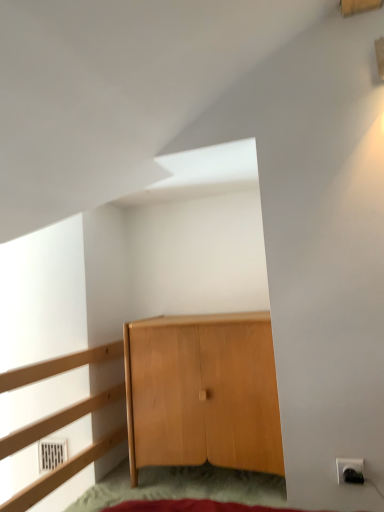
What do you see at coordinates (203, 393) in the screenshot? Image resolution: width=384 pixels, height=512 pixels. I see `light brown wood cabinet at center` at bounding box center [203, 393].

Locate an element on the screen. The width and height of the screenshot is (384, 512). light brown wood cabinet at center is located at coordinates (203, 393).

Measure the distance from light brown wood cabinet at center to white plastic electric outlet at lower right.

light brown wood cabinet at center is 67.56 centimeters from white plastic electric outlet at lower right.

Is light brown wood cabinet at center situated inside white plastic electric outlet at lower right or outside?

light brown wood cabinet at center is located beyond the bounds of white plastic electric outlet at lower right.

Considering the positions of points (278, 468) and (338, 465), is point (278, 468) farther from camera compared to point (338, 465)?

Yes, it is.

What's the angular difference between light brown wood cabinet at center and white plastic electric outlet at lower right's facing directions?

light brown wood cabinet at center and white plastic electric outlet at lower right are facing 0.00761 degrees away from each other.

Is light wood dresser at left positioned far away from light brown wood cabinet at center?

No, light wood dresser at left is not far from light brown wood cabinet at center.

Is light wood dresser at left positioned in front of light brown wood cabinet at center?

Yes, the depth of light wood dresser at left is less than that of light brown wood cabinet at center.

Based on the photo, can we say light wood dresser at left lies outside light brown wood cabinet at center?

That's correct, light wood dresser at left is outside of light brown wood cabinet at center.

How many degrees apart are the facing directions of light wood dresser at left and light brown wood cabinet at center?

0.381 degrees separate the facing orientations of light wood dresser at left and light brown wood cabinet at center.

This screenshot has width=384, height=512. Identify the location of dresser above the light brown wood cabinet at center (from a real-world perspective). (63, 472).

Is light brown wood cabinet at center located outside light wood dresser at left?

Absolutely, light brown wood cabinet at center is external to light wood dresser at left.

From the image's perspective, which is above, light brown wood cabinet at center or light wood dresser at left?

light wood dresser at left appears higher in the image.

Is light brown wood cabinet at center taller than light wood dresser at left?

No, light brown wood cabinet at center is not taller than light wood dresser at left.

What are the coordinates of `electric outlet below the light wood dresser at left (from the image's perspective)` in the screenshot? It's located at (350, 470).

Considering the sizes of white plastic electric outlet at lower right and light wood dresser at left in the image, is white plastic electric outlet at lower right bigger or smaller than light wood dresser at left?

Considering their sizes, white plastic electric outlet at lower right takes up less space than light wood dresser at left.

What's the angular difference between white plastic electric outlet at lower right and light wood dresser at left's facing directions?

0.375 degrees separate the facing orientations of white plastic electric outlet at lower right and light wood dresser at left.

Is white plastic electric outlet at lower right aimed at light wood dresser at left?

No, white plastic electric outlet at lower right is not turned towards light wood dresser at left.

From the image's perspective, relative to light brown wood cabinet at center, is white plastic electric outlet at lower right above or below?

white plastic electric outlet at lower right is situated lower than light brown wood cabinet at center in the image.

Does white plastic electric outlet at lower right lie in front of light brown wood cabinet at center?

Yes, white plastic electric outlet at lower right is in front of light brown wood cabinet at center.

How far apart are white plastic electric outlet at lower right and light brown wood cabinet at center?

26.60 inches.

Considering the relative sizes of white plastic electric outlet at lower right and light brown wood cabinet at center in the image provided, is white plastic electric outlet at lower right taller than light brown wood cabinet at center?

Incorrect, the height of white plastic electric outlet at lower right is not larger of that of light brown wood cabinet at center.

From their relative heights in the image, would you say light wood dresser at left is taller or shorter than white plastic electric outlet at lower right?

Considering their sizes, light wood dresser at left has more height than white plastic electric outlet at lower right.

Is light wood dresser at left wider than white plastic electric outlet at lower right?

Correct, the width of light wood dresser at left exceeds that of white plastic electric outlet at lower right.

Could you tell me if light wood dresser at left is turned towards white plastic electric outlet at lower right?

No, light wood dresser at left is not facing towards white plastic electric outlet at lower right.

The image size is (384, 512). I want to click on dresser in front of the white plastic electric outlet at lower right, so click(63, 472).

Where is `cupboard on the left of white plastic electric outlet at lower right`? cupboard on the left of white plastic electric outlet at lower right is located at coordinates (203, 393).

I want to click on cupboard located below the light wood dresser at left (from the image's perspective), so click(203, 393).

Considering their positions, is light brown wood cabinet at center positioned closer to white plastic electric outlet at lower right than light wood dresser at left?

Based on the image, light brown wood cabinet at center appears to be nearer to white plastic electric outlet at lower right.

When comparing their distances from white plastic electric outlet at lower right, does light wood dresser at left or light brown wood cabinet at center seem closer?

light brown wood cabinet at center lies closer to white plastic electric outlet at lower right than the other object.

Looking at this image, looking at the image, which one is located further to light brown wood cabinet at center, white plastic electric outlet at lower right or light wood dresser at left?

white plastic electric outlet at lower right lies further to light brown wood cabinet at center than the other object.

Based on their spatial positions, is white plastic electric outlet at lower right or light brown wood cabinet at center further from light wood dresser at left?

The object further to light wood dresser at left is white plastic electric outlet at lower right.

Which object lies nearer to the anchor point light wood dresser at left, light brown wood cabinet at center or white plastic electric outlet at lower right?

light brown wood cabinet at center is positioned closer to the anchor light wood dresser at left.

Based on their spatial positions, is light wood dresser at left or white plastic electric outlet at lower right closer to light brown wood cabinet at center?

light wood dresser at left.

Locate an element on the screen. The image size is (384, 512). cupboard between light wood dresser at left and white plastic electric outlet at lower right is located at coordinates [x=203, y=393].